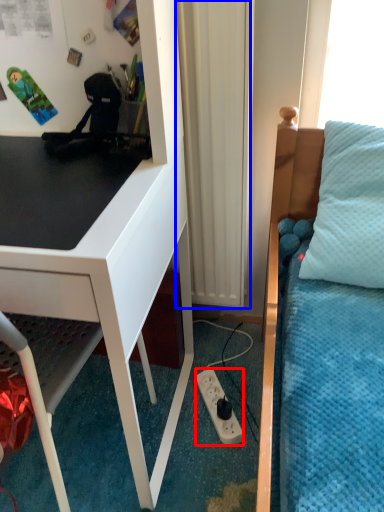
Question: Among these objects, which one is farthest to the camera, power outlet (highlighted by a red box) or curtain (highlighted by a blue box)?

Choices:
 (A) power outlet
 (B) curtain

Answer: (A)